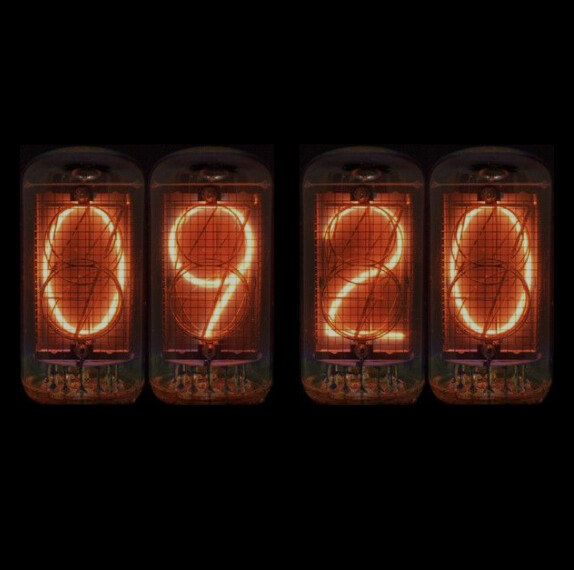
Locate an element on the screen. Image resolution: width=574 pixels, height=570 pixels. light is located at coordinates (94, 337), (224, 287), (360, 280), (498, 268).